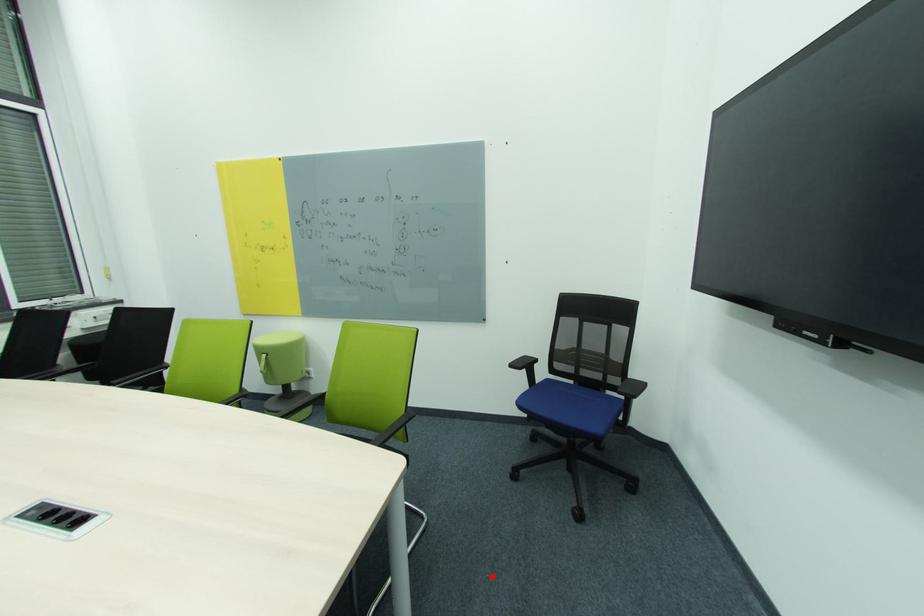
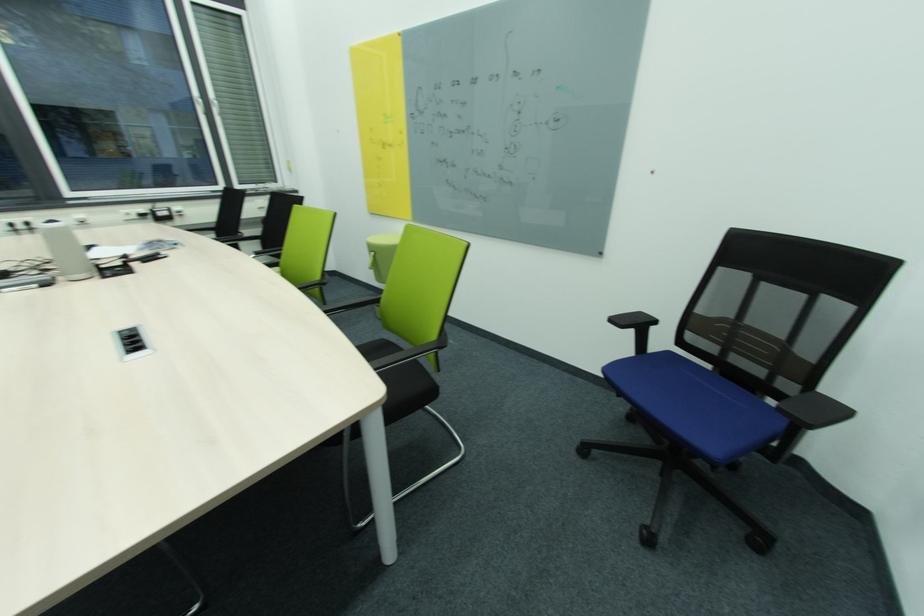
Locate, in the second image, the point that corresponds to the highlighted location in the first image.

(503, 544)